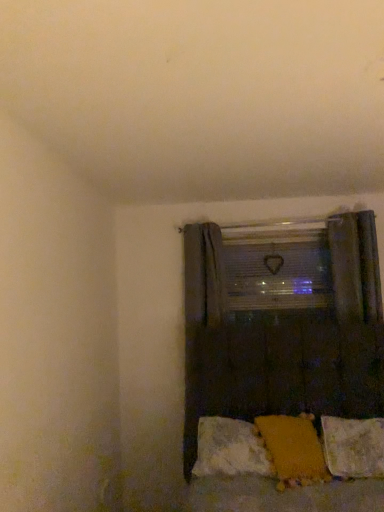
Question: Is fluffy white pillow at lower right, which is the first pillow in right-to-left order, completely or partially outside of yellow fabric pillow at lower center, positioned as the second pillow in right-to-left order?

Choices:
 (A) no
 (B) yes

Answer: (B)

Question: Is fluffy white pillow at lower right, the 3th pillow when ordered from left to right, positioned in front of yellow fabric pillow at lower center, positioned as the second pillow in right-to-left order?

Choices:
 (A) no
 (B) yes

Answer: (A)

Question: Is fluffy white pillow at lower right, the 3th pillow when ordered from left to right, at the left side of yellow fabric pillow at lower center, which ranks as the 2th pillow in left-to-right order?

Choices:
 (A) no
 (B) yes

Answer: (A)

Question: Is fluffy white pillow at lower right, which is the first pillow in right-to-left order, not close to yellow fabric pillow at lower center, which ranks as the 2th pillow in left-to-right order?

Choices:
 (A) no
 (B) yes

Answer: (A)

Question: Does fluffy white pillow at lower right, which is the first pillow in right-to-left order, turn towards yellow fabric pillow at lower center, which ranks as the 2th pillow in left-to-right order?

Choices:
 (A) yes
 (B) no

Answer: (B)

Question: From the image's perspective, is fluffy white pillow at lower right, which is the first pillow in right-to-left order, located beneath yellow fabric pillow at lower center, positioned as the second pillow in right-to-left order?

Choices:
 (A) yes
 (B) no

Answer: (A)

Question: Can you confirm if orange fabric pillow at lower center, the third pillow from the right, is smaller than clear plastic window screen at center?

Choices:
 (A) no
 (B) yes

Answer: (A)

Question: From the image's perspective, is orange fabric pillow at lower center, the third pillow from the right, above clear plastic window screen at center?

Choices:
 (A) yes
 (B) no

Answer: (B)

Question: From the image's perspective, is orange fabric pillow at lower center, which is counted as the first pillow, starting from the left, beneath clear plastic window screen at center?

Choices:
 (A) yes
 (B) no

Answer: (A)

Question: Is there a large distance between orange fabric pillow at lower center, the third pillow from the right, and clear plastic window screen at center?

Choices:
 (A) yes
 (B) no

Answer: (A)

Question: Considering the relative positions of orange fabric pillow at lower center, which is counted as the first pillow, starting from the left, and clear plastic window screen at center in the image provided, is orange fabric pillow at lower center, which is counted as the first pillow, starting from the left, to the left of clear plastic window screen at center from the viewer's perspective?

Choices:
 (A) yes
 (B) no

Answer: (A)

Question: From a real-world perspective, is orange fabric pillow at lower center, the third pillow from the right, on clear plastic window screen at center?

Choices:
 (A) no
 (B) yes

Answer: (A)

Question: Can you confirm if fluffy white pillow at lower right, the 3th pillow when ordered from left to right, is thinner than orange fabric pillow at lower center, which is counted as the first pillow, starting from the left?

Choices:
 (A) yes
 (B) no

Answer: (B)